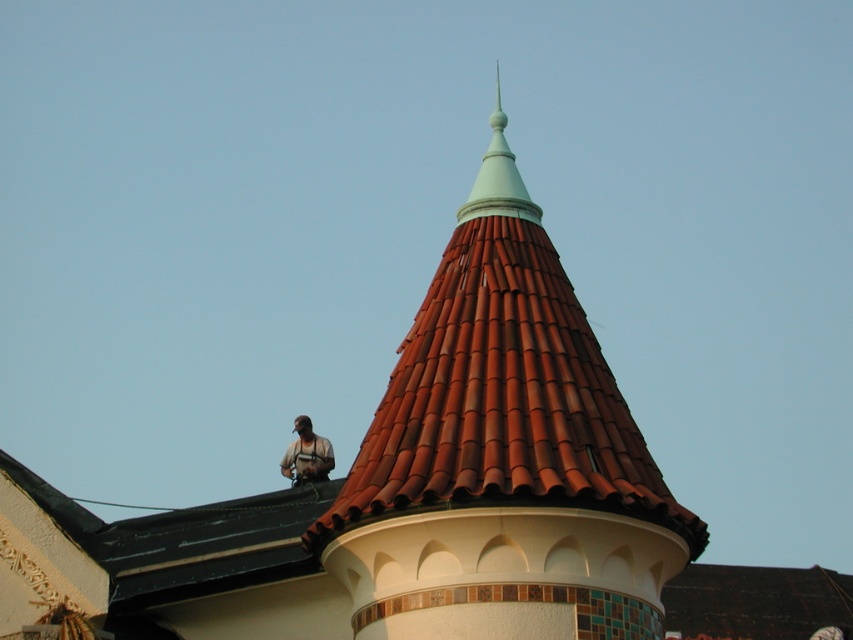
Question: Which of these objects is positioned farthest from the light teal plastic spire at upper center?

Choices:
 (A) brown tile roof at upper center
 (B) camouflage fabric shirt at upper center

Answer: (B)

Question: Does light teal plastic spire at upper center appear on the right side of camouflage fabric shirt at upper center?

Choices:
 (A) no
 (B) yes

Answer: (B)

Question: Does brown tile roof at upper center have a smaller size compared to light teal plastic spire at upper center?

Choices:
 (A) no
 (B) yes

Answer: (A)

Question: Considering the relative positions of brown tile roof at upper center and camouflage fabric shirt at upper center in the image provided, where is brown tile roof at upper center located with respect to camouflage fabric shirt at upper center?

Choices:
 (A) below
 (B) above

Answer: (B)

Question: Which of the following is the farthest from the observer?

Choices:
 (A) (500, 104)
 (B) (326, 440)

Answer: (A)

Question: Based on their relative distances, which object is farther from the camouflage fabric shirt at upper center?

Choices:
 (A) light teal plastic spire at upper center
 (B) brown tile roof at upper center

Answer: (A)